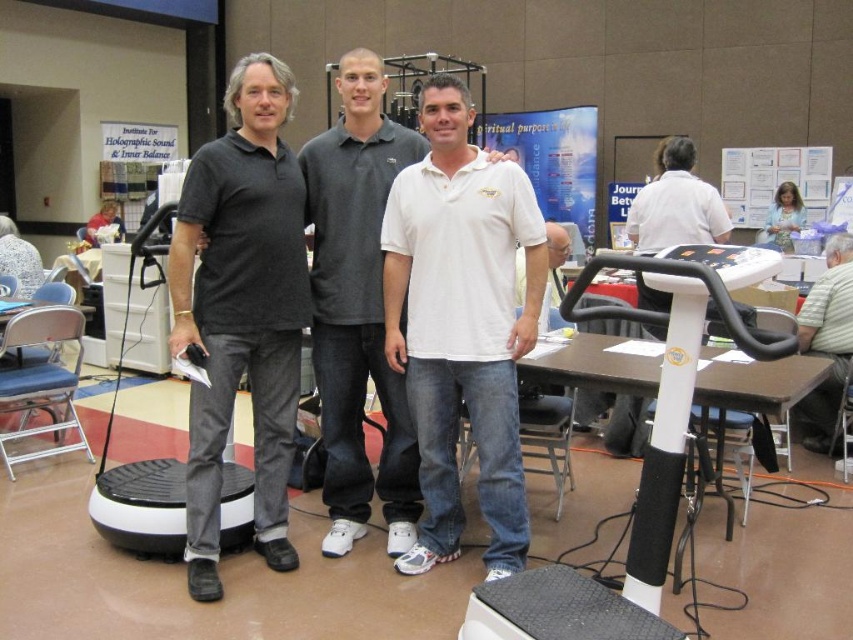
Between point (321, 257) and point (833, 266), which one is positioned behind?

The point (833, 266) is more distant.

In the scene shown: Does white matte shirt at center have a greater height compared to gray striped shirt at lower right?

Correct, white matte shirt at center is much taller as gray striped shirt at lower right.

Which is behind, point (351, 204) or point (840, 294)?

The point (840, 294) is more distant.

Locate an element on the screen. The image size is (853, 640). white matte shirt at center is located at coordinates (357, 308).

Can you confirm if black matte polo shirt at left is smaller than blue fabric shirt at center?

Actually, black matte polo shirt at left might be larger than blue fabric shirt at center.

Who is more distant from viewer, (268,483) or (776,196)?

Positioned behind is point (776,196).

I want to click on black matte polo shirt at left, so click(242, 310).

Can you confirm if white plastic exercise machine at right is wider than blue fabric shirt at center?

Indeed, white plastic exercise machine at right has a greater width compared to blue fabric shirt at center.

Who is more forward, (672, 240) or (769, 227)?

Point (672, 240) is more forward.

Find the location of a particular element. This screenshot has height=640, width=853. white plastic exercise machine at right is located at coordinates (676, 204).